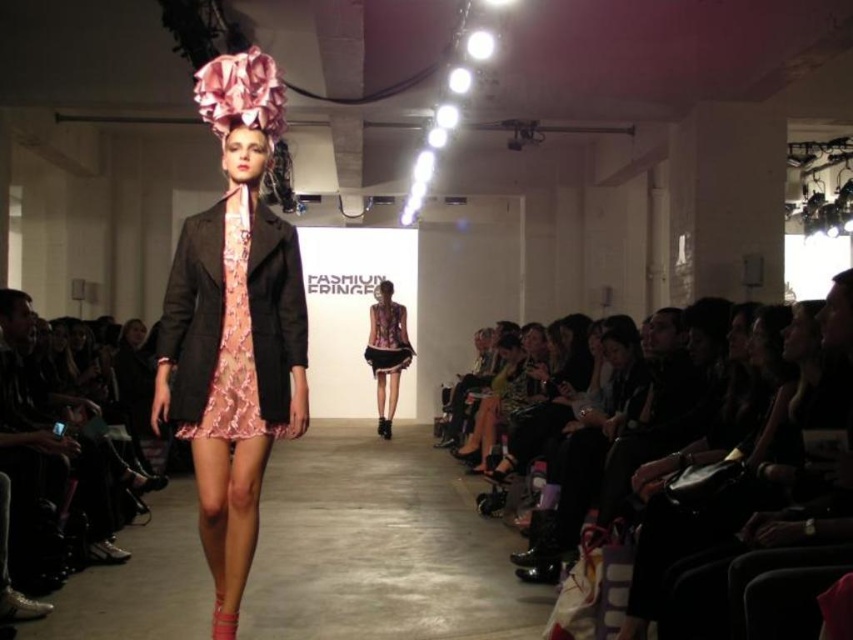
You are a photographer positioned at the end of the runway. You need to capture a photo of both the pink floral dress at center and the black leather jacket at center. Which one will appear closer to you in the photo?

The pink floral dress at center will appear closer to you in the photo because it is positioned further to the viewer than the black leather jacket at center.

You are a fashion designer who wants to ensure the black leather jacket at center and metallic pink dress at center are displayed properly on a mannequin. The mannequin is 1.8 meters tall. Can the jacket and dress be placed on the mannequin without overlapping each other?

The distance between the black leather jacket at center and metallic pink dress at center is 8.02 meters, which is much larger than the mannequin height of 1.8 meters. Therefore, the jacket and dress can be placed on the mannequin without overlapping.